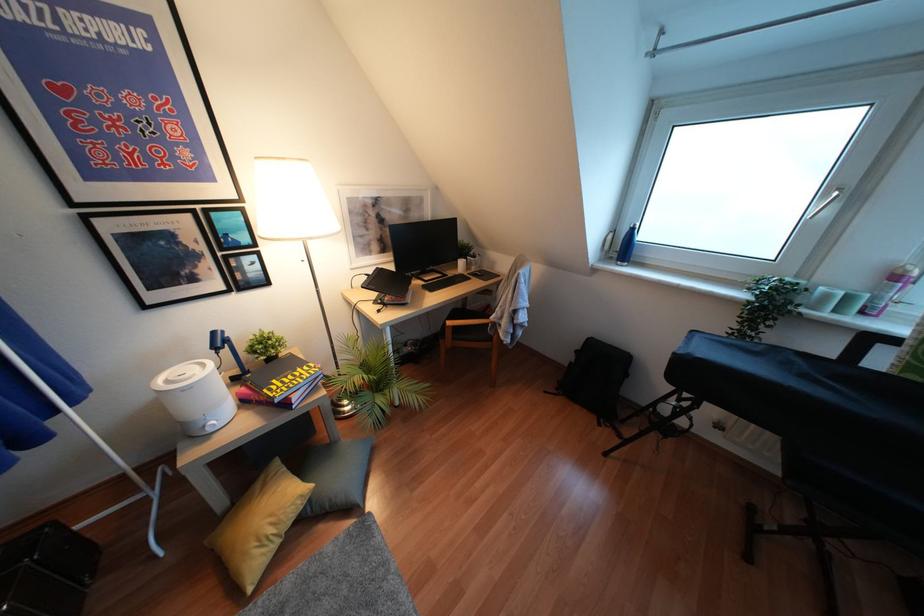
Where would you lift the grey floor pillow? Please return your answer as a coordinate pair (x, y).

(335, 475)